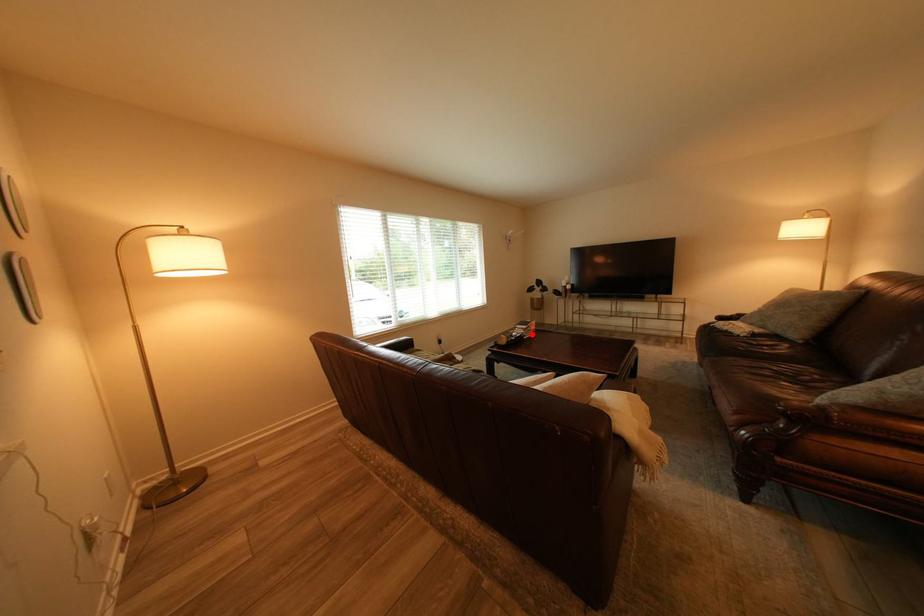
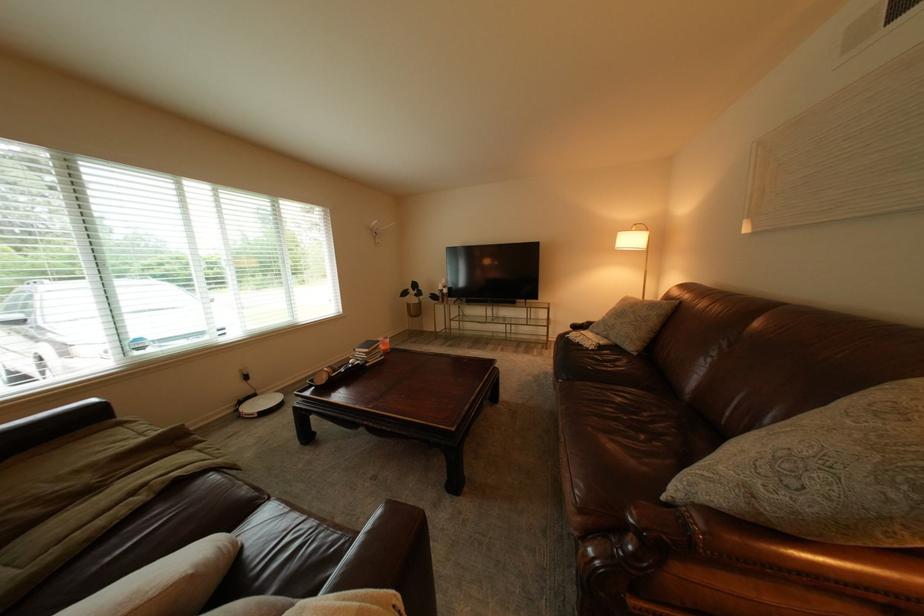
The point at the highlighted location is marked in the first image. Where is the corresponding point in the second image?

(371, 361)